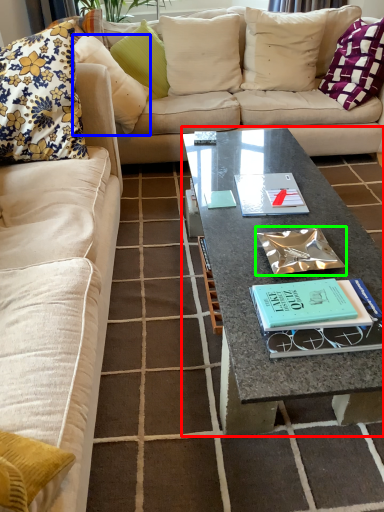
Question: Based on their relative distances, which object is nearer to coffee table (highlighted by a red box)? Choose from pillow (highlighted by a blue box) and book (highlighted by a green box).

Choices:
 (A) pillow
 (B) book

Answer: (B)